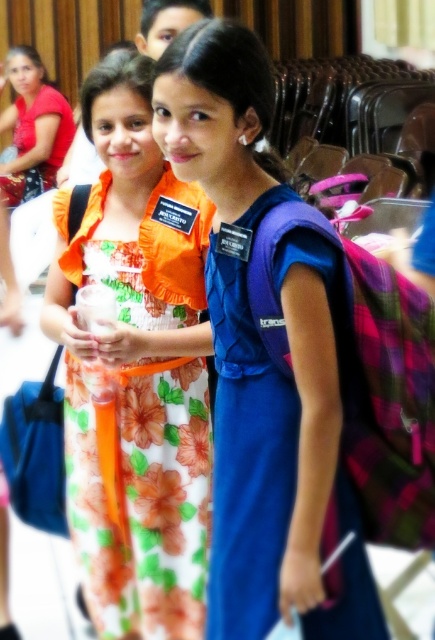
Based on the photo, you are standing in the auditorium and see the point marked at coordinates (137,369). What object is located at that position?

The point at coordinates (137,369) corresponds to the floral dress at center.

You are a photographer setting up for a group photo. You notice the purple fabric backpack at center and the matte red dress at upper left. Which object is closer to the camera?

The purple fabric backpack at center is closer to the camera because it is in front of the matte red dress at upper left.